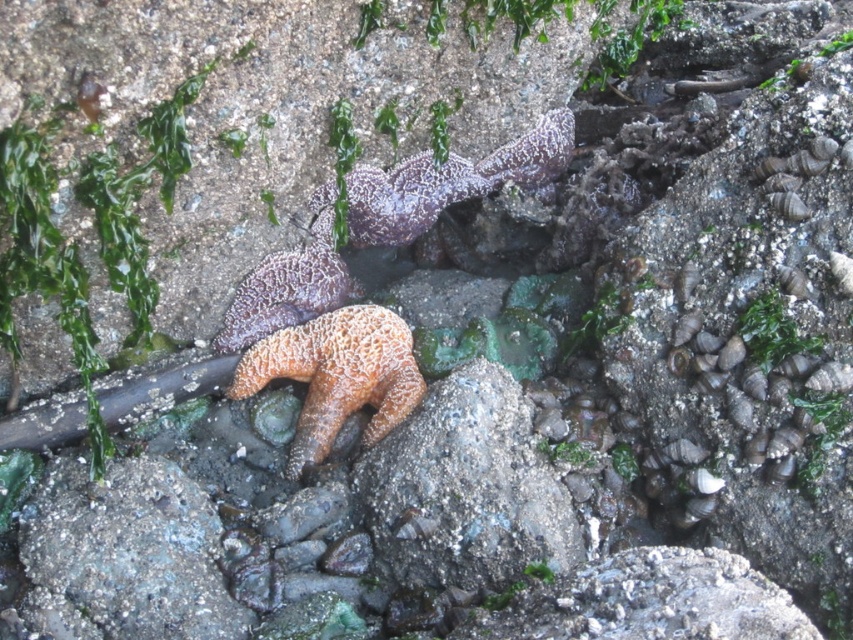
Is orange rough starfish at center thinner than textured purple starfish at center?

No.

Measure the distance between point (355, 349) and camera.

The distance of point (355, 349) from camera is 1.25 meters.

Where is `orange rough starfish at center`? The height and width of the screenshot is (640, 853). orange rough starfish at center is located at coordinates (335, 376).

Does textured purple starfish at center have a lesser height compared to green matte algae at center right?

No, textured purple starfish at center is not shorter than green matte algae at center right.

How far apart are textured purple starfish at center and green matte algae at center right?

A distance of 23.66 inches exists between textured purple starfish at center and green matte algae at center right.

Between point (344, 266) and point (753, 349), which one is positioned behind?

Point (344, 266)

Where is `textured purple starfish at center`? textured purple starfish at center is located at coordinates (287, 289).

Can you confirm if purple matte starfish at center is positioned to the right of green matte algae at center right?

Incorrect, purple matte starfish at center is not on the right side of green matte algae at center right.

Locate an element on the screen. Image resolution: width=853 pixels, height=640 pixels. purple matte starfish at center is located at coordinates (450, 180).